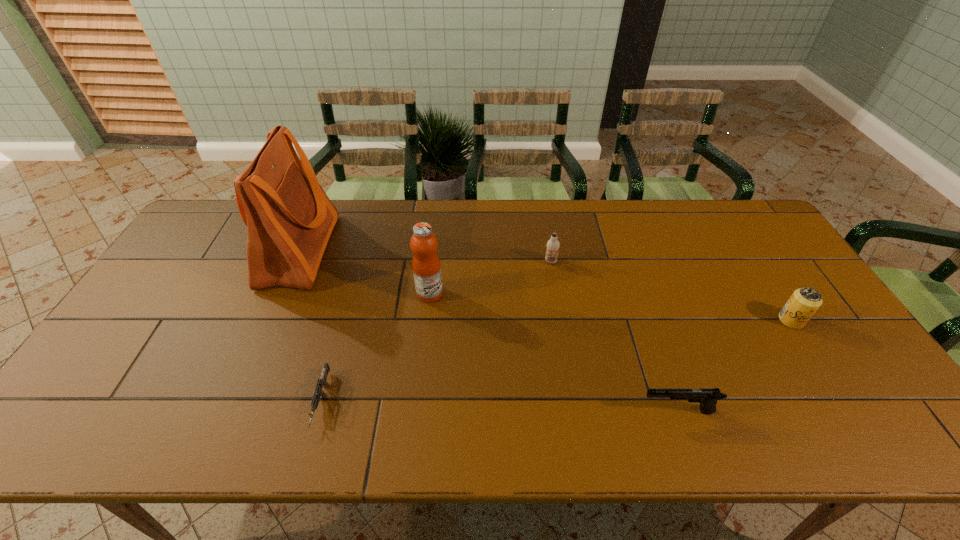
The width and height of the screenshot is (960, 540). I want to click on vacant space at the far edge, so (x=612, y=216).

Where is `blank space at the near edge`? This screenshot has width=960, height=540. blank space at the near edge is located at coordinates (190, 416).

The width and height of the screenshot is (960, 540). In the image, there is a desktop. Find the location of `vacant space at the left edge`. vacant space at the left edge is located at coordinates (170, 276).

In order to click on vacant space at the far right corner of the desktop in this screenshot , I will do coord(749,242).

This screenshot has height=540, width=960. In the image, there is a desktop. What are the coordinates of `blank space at the near right corner` in the screenshot? It's located at (845, 425).

What are the coordinates of `empty space between the right gun and the fruit juice` in the screenshot? It's located at (554, 352).

Where is `free area in between the leftmost object and the beer can`? free area in between the leftmost object and the beer can is located at coordinates (545, 286).

Where is `vacant region between the taller gun and the shorter gun`? This screenshot has width=960, height=540. vacant region between the taller gun and the shorter gun is located at coordinates (499, 406).

Find the location of a particular element. free spot between the second object from left to right and the fifth tallest object is located at coordinates (499, 406).

The width and height of the screenshot is (960, 540). I want to click on free spot between the shorter gun and the second tallest object, so click(x=375, y=347).